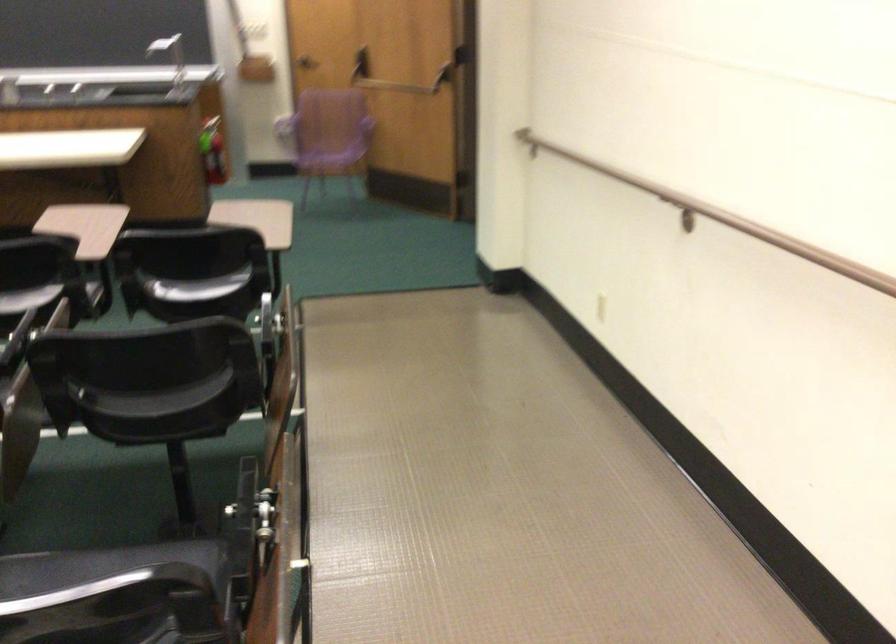
The width and height of the screenshot is (896, 644). Find the location of `door pull handle`. door pull handle is located at coordinates (359, 77).